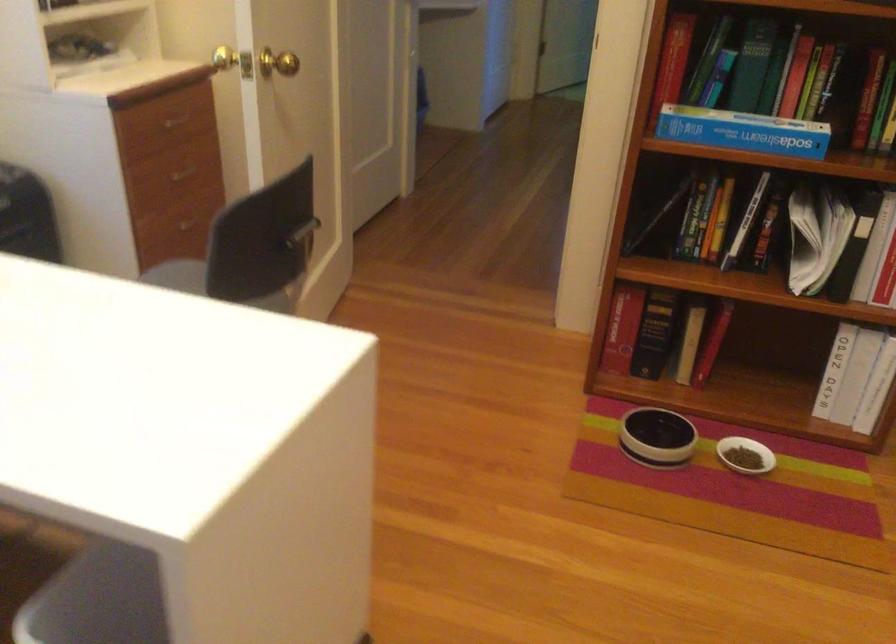
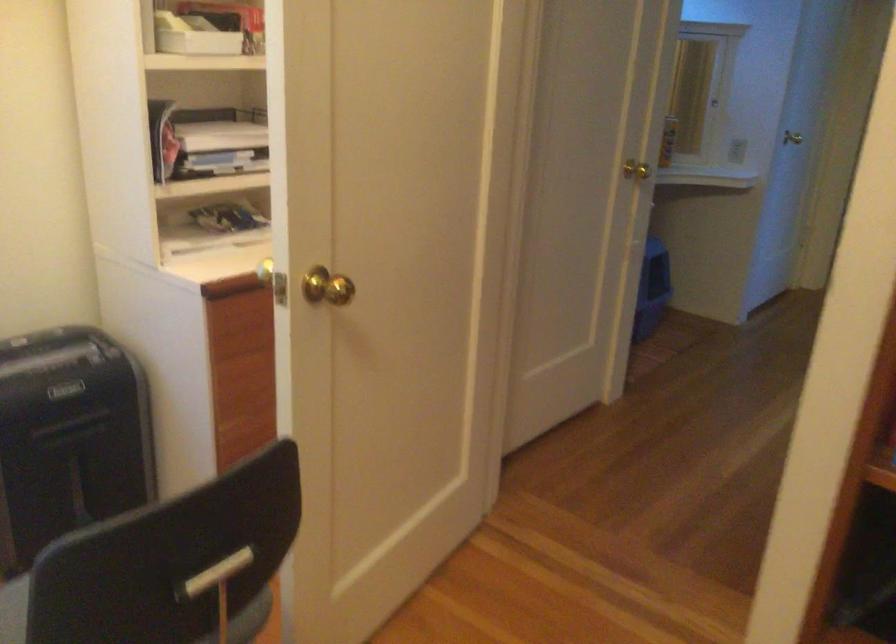
In a continuous first-person perspective shot, in which direction is the camera moving?

The movement direction of the cameraman is right, forward.